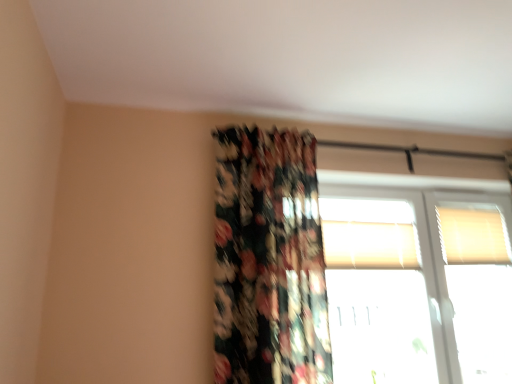
Question: Does transparent glass window at upper right, the third window when ordered from top to bottom, lie in front of white textured blinds at upper center, the second window ordered from the bottom?

Choices:
 (A) yes
 (B) no

Answer: (A)

Question: From a real-world perspective, is transparent glass window at upper right, the third window when ordered from top to bottom, located beneath white textured blinds at upper center, the second window ordered from the bottom?

Choices:
 (A) yes
 (B) no

Answer: (A)

Question: From a real-world perspective, is transparent glass window at upper right, the third window when ordered from top to bottom, on white textured blinds at upper center, the second window ordered from the bottom?

Choices:
 (A) yes
 (B) no

Answer: (B)

Question: Could you tell me if transparent glass window at upper right, marked as the 1th window in a bottom-to-top arrangement, is turned towards white textured blinds at upper center, the second window ordered from the bottom?

Choices:
 (A) yes
 (B) no

Answer: (A)

Question: Is transparent glass window at upper right, marked as the 1th window in a bottom-to-top arrangement, at the left side of white textured blinds at upper center, the second window ordered from the bottom?

Choices:
 (A) yes
 (B) no

Answer: (B)

Question: Would you say floral fabric curtain at center is to the left or to the right of white textured blinds at upper right, positioned as the first window in top-to-bottom order, in the picture?

Choices:
 (A) right
 (B) left

Answer: (B)

Question: From a real-world perspective, relative to white textured blinds at upper right, positioned as the first window in top-to-bottom order, is floral fabric curtain at center vertically above or below?

Choices:
 (A) below
 (B) above

Answer: (A)

Question: From their relative heights in the image, would you say floral fabric curtain at center is taller or shorter than white textured blinds at upper right, the 3th window positioned from the bottom?

Choices:
 (A) short
 (B) tall

Answer: (B)

Question: Looking at the image, does floral fabric curtain at center seem bigger or smaller compared to white textured blinds at upper right, the 3th window positioned from the bottom?

Choices:
 (A) big
 (B) small

Answer: (A)

Question: From the image's perspective, is floral fabric curtain at center located above or below transparent glass window at upper right, the third window when ordered from top to bottom?

Choices:
 (A) above
 (B) below

Answer: (A)

Question: Looking at the image, does floral fabric curtain at center seem bigger or smaller compared to transparent glass window at upper right, marked as the 1th window in a bottom-to-top arrangement?

Choices:
 (A) small
 (B) big

Answer: (B)

Question: From a real-world perspective, is floral fabric curtain at center above or below transparent glass window at upper right, marked as the 1th window in a bottom-to-top arrangement?

Choices:
 (A) above
 (B) below

Answer: (A)

Question: Considering the positions of point (226, 163) and point (442, 367), is point (226, 163) closer or farther from the camera than point (442, 367)?

Choices:
 (A) closer
 (B) farther

Answer: (A)

Question: Looking at their shapes, would you say transparent glass window at upper right, marked as the 1th window in a bottom-to-top arrangement, is wider or thinner than white textured blinds at upper right, positioned as the first window in top-to-bottom order?

Choices:
 (A) thin
 (B) wide

Answer: (B)

Question: Is point (360, 253) closer or farther from the camera than point (449, 256)?

Choices:
 (A) closer
 (B) farther

Answer: (A)